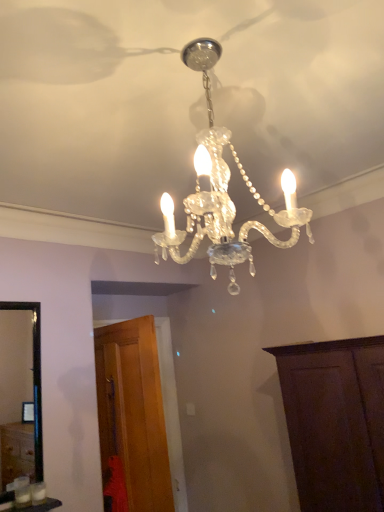
Question: From the image's perspective, is clear crystal chandelier at center positioned above or below dark wood cabinet at lower right, the 2th cabinetry when ordered from left to right?

Choices:
 (A) above
 (B) below

Answer: (A)

Question: Considering the positions of clear crystal chandelier at center and dark wood cabinet at lower right, the 2th cabinetry when ordered from left to right, in the image, is clear crystal chandelier at center wider or thinner than dark wood cabinet at lower right, the 2th cabinetry when ordered from left to right,?

Choices:
 (A) wide
 (B) thin

Answer: (B)

Question: Which is farther from the wooden door at lower left, acting as the 2th cabinetry starting from the right?

Choices:
 (A) dark wood cabinet at lower right, which is counted as the first cabinetry, starting from the right
 (B) clear crystal chandelier at center

Answer: (B)

Question: Based on their relative distances, which object is nearer to the wooden door at lower left, the first cabinetry viewed from the left?

Choices:
 (A) clear crystal chandelier at center
 (B) dark wood cabinet at lower right, which is counted as the first cabinetry, starting from the right

Answer: (B)